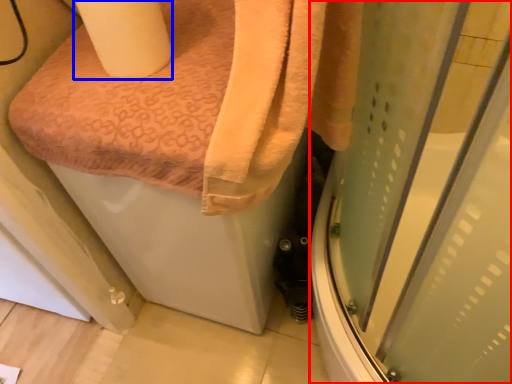
Question: Which of the following is the farthest to the observer, screen door (highlighted by a red box) or toilet paper (highlighted by a blue box)?

Choices:
 (A) screen door
 (B) toilet paper

Answer: (B)